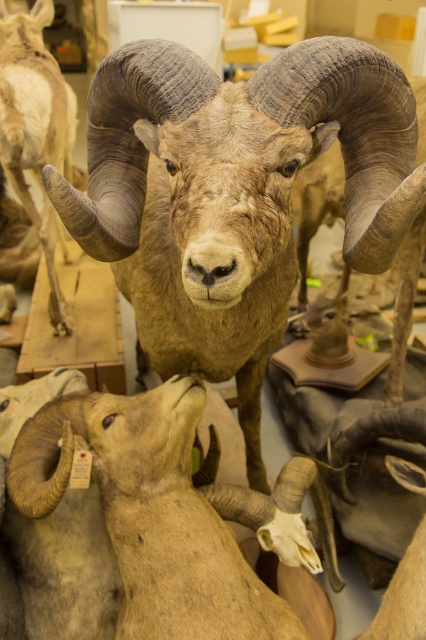
Is point (155, 196) farther from viewer compared to point (204, 499)?

Yes.

Is brown textured ram at center taller than light brown woolen sheep at lower center?

Correct, brown textured ram at center is much taller as light brown woolen sheep at lower center.

Measure the distance between point (345, 97) and camera.

Point (345, 97) is 37.48 inches away from camera.

Identify the location of brown textured ram at center. The image size is (426, 640). (233, 195).